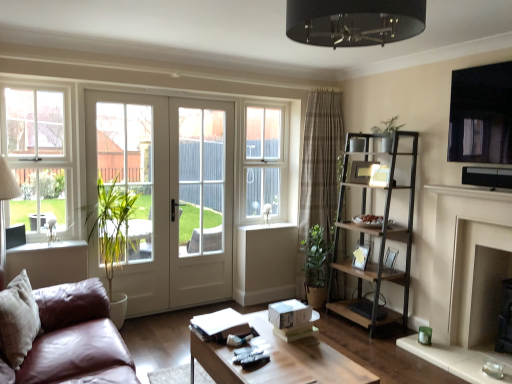
At what (x,y) coordinates should I click in order to perform the action: click on empty space that is ontop of wooden coffee table at center (from a real-world perspective). Please return your answer as a coordinate pair (x, y). This screenshot has width=512, height=384. Looking at the image, I should click on (282, 358).